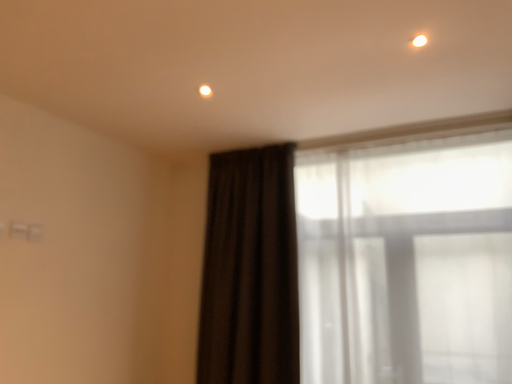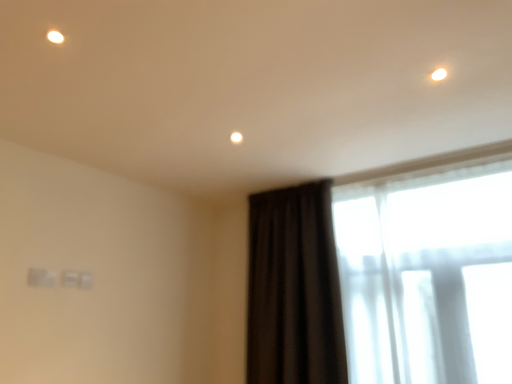
Question: How did the camera likely rotate when shooting the video?

Choices:
 (A) rotated left
 (B) rotated right

Answer: (A)